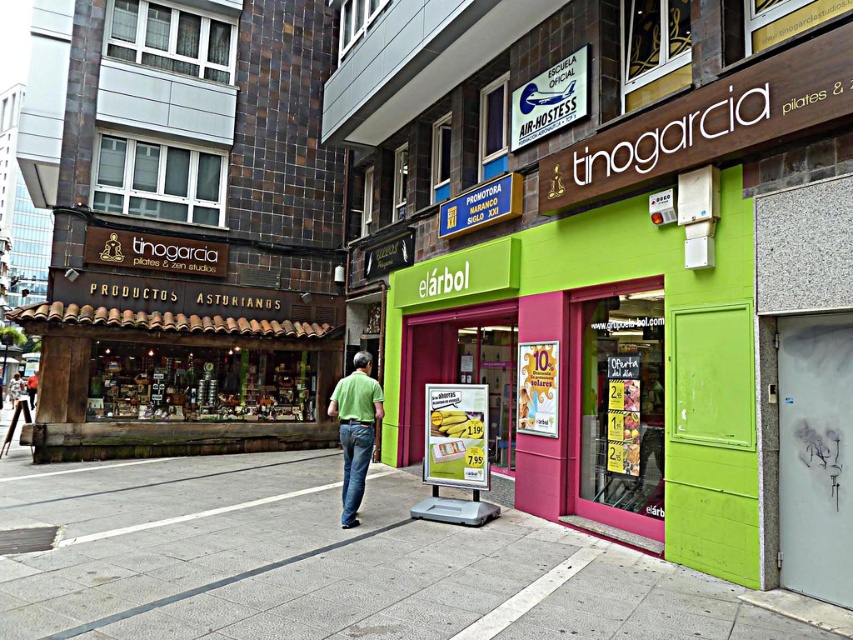
Does gray concrete sidewalk at center come in front of green fabric shirt at center?

Yes, it is in front of green fabric shirt at center.

Does gray concrete sidewalk at center appear over green fabric shirt at center?

Yes, gray concrete sidewalk at center is above green fabric shirt at center.

Is point (444, 556) closer to viewer compared to point (33, 388)?

Yes.

This screenshot has height=640, width=853. In order to click on gray concrete sidewalk at center in this screenshot , I will do click(x=325, y=563).

Does green matte shirt at center lie in front of light green shirt at center?

That is True.

Does point (367, 387) come behind point (24, 410)?

No, (367, 387) is closer to viewer.

This screenshot has width=853, height=640. I want to click on green matte shirt at center, so click(355, 429).

Does green matte storefront at center have a lesser width compared to green matte shirt at center?

In fact, green matte storefront at center might be wider than green matte shirt at center.

Who is shorter, green matte storefront at center or green matte shirt at center?

Standing shorter between the two is green matte storefront at center.

Does point (665, 282) lie behind point (341, 403)?

No.

You are a GUI agent. You are given a task and a screenshot of the screen. Output one action in this format:
    pyautogui.click(x=<x>, y=<y>)
    Task: Click on the green matte storefront at center
    This screenshot has width=853, height=640.
    Given the screenshot: What is the action you would take?
    pyautogui.click(x=608, y=372)